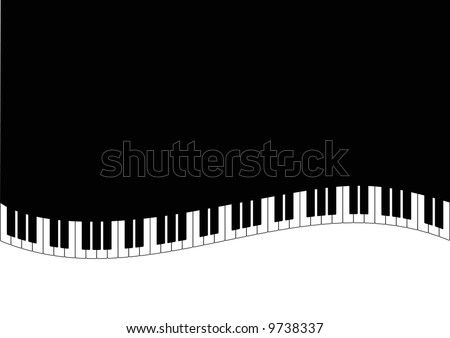
Find the location of a particular element. The width and height of the screenshot is (450, 338). pairs of black keys is located at coordinates (58, 233), (140, 231), (212, 227), (291, 215), (366, 209), (437, 219).